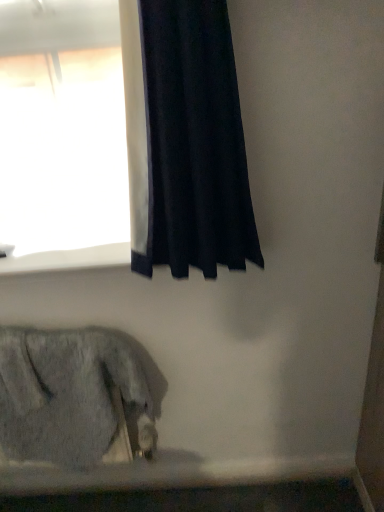
Question: Is white smooth window sill at upper left located within black velvet curtain at upper left?

Choices:
 (A) no
 (B) yes

Answer: (A)

Question: From the image's perspective, is black velvet curtain at upper left beneath white smooth window sill at upper left?

Choices:
 (A) yes
 (B) no

Answer: (B)

Question: Can you confirm if black velvet curtain at upper left is smaller than white smooth window sill at upper left?

Choices:
 (A) no
 (B) yes

Answer: (A)

Question: Is black velvet curtain at upper left positioned behind white smooth window sill at upper left?

Choices:
 (A) no
 (B) yes

Answer: (A)

Question: Is black velvet curtain at upper left oriented towards white smooth window sill at upper left?

Choices:
 (A) no
 (B) yes

Answer: (A)

Question: Considering the positions of fuzzy gray cat at lower left and black velvet curtain at upper left in the image, is fuzzy gray cat at lower left taller or shorter than black velvet curtain at upper left?

Choices:
 (A) tall
 (B) short

Answer: (B)

Question: Relative to black velvet curtain at upper left, is fuzzy gray cat at lower left in front or behind?

Choices:
 (A) behind
 (B) front

Answer: (A)

Question: Looking at the image, does fuzzy gray cat at lower left seem bigger or smaller compared to black velvet curtain at upper left?

Choices:
 (A) big
 (B) small

Answer: (A)

Question: Would you say fuzzy gray cat at lower left is to the left or to the right of black velvet curtain at upper left in the picture?

Choices:
 (A) right
 (B) left

Answer: (B)

Question: From a real-world perspective, is fuzzy gray cat at lower left above or below white smooth window sill at upper left?

Choices:
 (A) below
 (B) above

Answer: (A)

Question: Considering the positions of point (64, 335) and point (89, 260), is point (64, 335) closer or farther from the camera than point (89, 260)?

Choices:
 (A) closer
 (B) farther

Answer: (B)

Question: Based on their sizes in the image, would you say fuzzy gray cat at lower left is bigger or smaller than white smooth window sill at upper left?

Choices:
 (A) big
 (B) small

Answer: (A)

Question: In the image, is fuzzy gray cat at lower left positioned in front of or behind white smooth window sill at upper left?

Choices:
 (A) front
 (B) behind

Answer: (A)

Question: Is point (81, 264) positioned closer to the camera than point (210, 261)?

Choices:
 (A) closer
 (B) farther

Answer: (B)

Question: From a real-world perspective, is white smooth window sill at upper left positioned above or below black velvet curtain at upper left?

Choices:
 (A) below
 (B) above

Answer: (A)